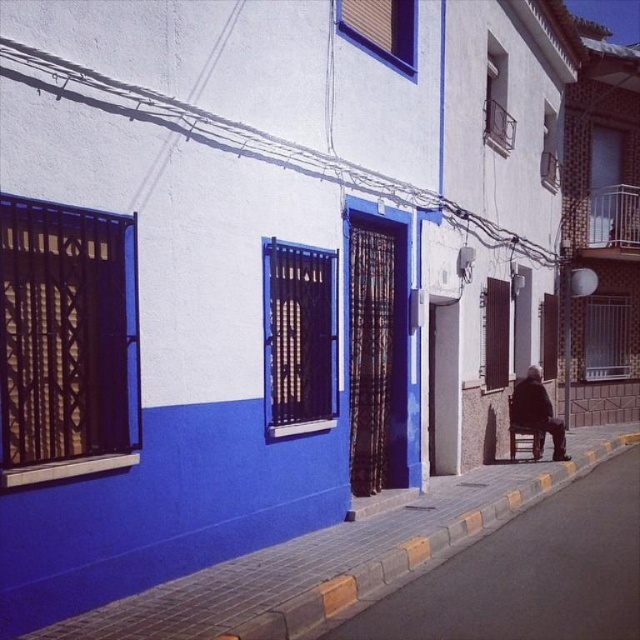
Looking at this image, can you confirm if smooth concrete pavement at lower center is positioned to the left of dark brown leather jacket at lower right?

Correct, you'll find smooth concrete pavement at lower center to the left of dark brown leather jacket at lower right.

Is smooth concrete pavement at lower center positioned behind dark brown leather jacket at lower right?

No, smooth concrete pavement at lower center is in front of dark brown leather jacket at lower right.

Does point (560, 566) lie in front of point (564, 440)?

Yes, it is in front of point (564, 440).

Where is `smooth concrete pavement at lower center`? smooth concrete pavement at lower center is located at coordinates (529, 572).